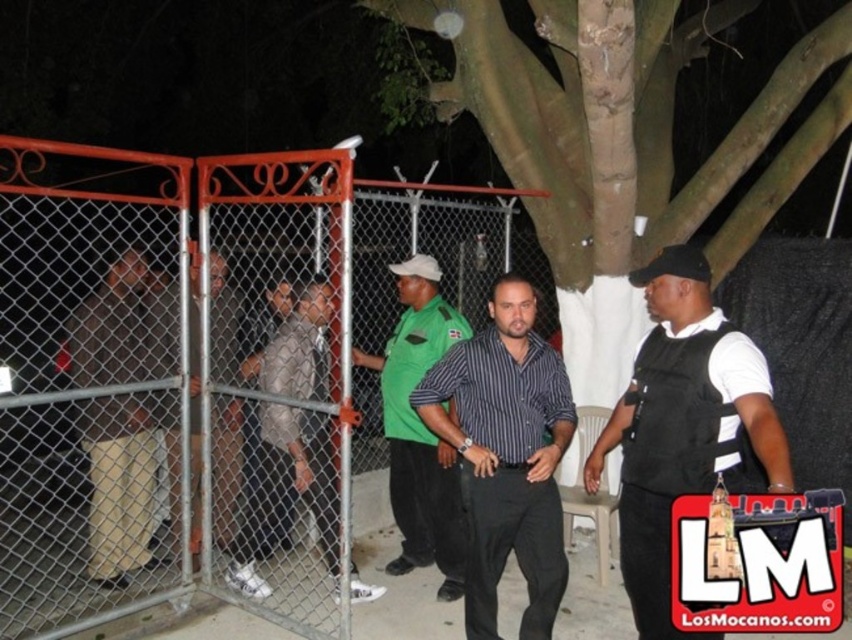
Is the position of striped cotton shirt at center less distant than that of khaki pants at left?

Yes.

Between point (556, 401) and point (122, 307), which one is positioned behind?

The point (122, 307) is behind.

Is point (487, 394) less distant than point (151, 474)?

Yes, point (487, 394) is in front of point (151, 474).

At what (x,y) coordinates should I click in order to perform the action: click on striped cotton shirt at center. Please return your answer as a coordinate pair (x, y). The image size is (852, 640). Looking at the image, I should click on (505, 456).

Based on the photo, does orange chain-link fence at left lie in front of light brown leather jacket at center?

That is True.

Which of these two, orange chain-link fence at left or light brown leather jacket at center, stands shorter?

Standing shorter between the two is light brown leather jacket at center.

Who is more distant from viewer, [3,454] or [231,580]?

Point [3,454]

Identify the location of orange chain-link fence at left. (160, 385).

Does black matte vest at right have a lesser height compared to khaki pants at left?

Indeed, black matte vest at right has a lesser height compared to khaki pants at left.

Describe the element at coordinates (682, 426) in the screenshot. I see `black matte vest at right` at that location.

Between point (783, 461) and point (145, 528), which one is positioned behind?

Positioned behind is point (145, 528).

Locate an element on the screen. The image size is (852, 640). black matte vest at right is located at coordinates (682, 426).